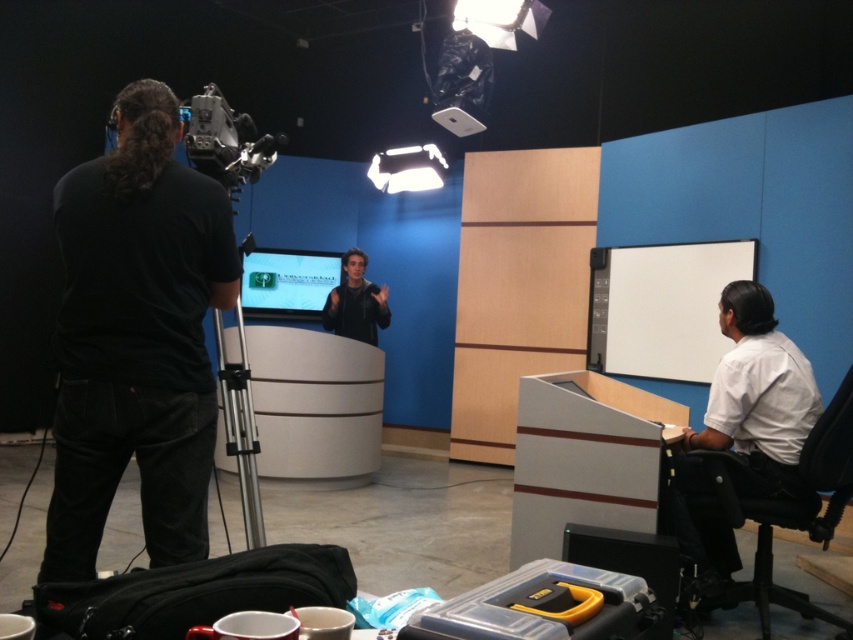
Who is taller, black leather chair at lower right or matte black video camera at upper left?

black leather chair at lower right is taller.

What are the coordinates of `black leather chair at lower right` in the screenshot? It's located at (782, 512).

The image size is (853, 640). I want to click on black leather chair at lower right, so click(x=782, y=512).

Locate an element on the screen. The width and height of the screenshot is (853, 640). matte black video camera at upper left is located at coordinates (225, 140).

Can you confirm if matte black video camera at upper left is taller than black matte jacket at center?

No, matte black video camera at upper left is not taller than black matte jacket at center.

Is point (189, 131) positioned before point (326, 308)?

Yes.

Where is `matte black video camera at upper left`? This screenshot has width=853, height=640. matte black video camera at upper left is located at coordinates (225, 140).

Is black matte shirt at left wider than matte green screen at center?

No.

Can you confirm if black matte shirt at left is positioned to the left of matte green screen at center?

No, black matte shirt at left is not to the left of matte green screen at center.

Image resolution: width=853 pixels, height=640 pixels. Find the location of `black matte shirt at left`. black matte shirt at left is located at coordinates tap(136, 337).